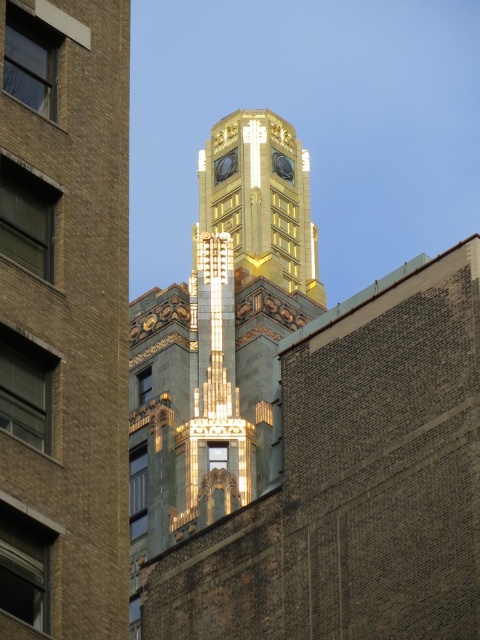
Question: Which point appears farthest from the camera in this image?

Choices:
 (A) (253, 252)
 (B) (194, 458)

Answer: (A)

Question: Among these objects, which one is nearest to the camera?

Choices:
 (A) gold metallic bell tower at center
 (B) gold metallic clock tower at center

Answer: (A)

Question: Is gold metallic clock tower at center positioned in front of gold metallic bell tower at center?

Choices:
 (A) no
 (B) yes

Answer: (A)

Question: Does gold metallic clock tower at center appear under gold metallic bell tower at center?

Choices:
 (A) no
 (B) yes

Answer: (A)

Question: Which point is closer to the camera?

Choices:
 (A) (216, 310)
 (B) (232, 225)

Answer: (A)

Question: Does gold metallic clock tower at center come in front of gold metallic bell tower at center?

Choices:
 (A) no
 (B) yes

Answer: (A)